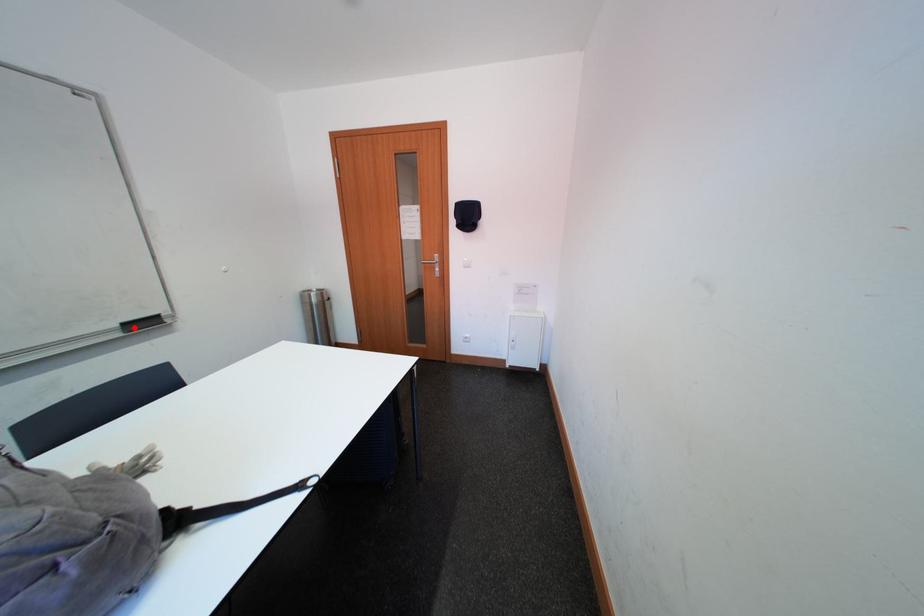
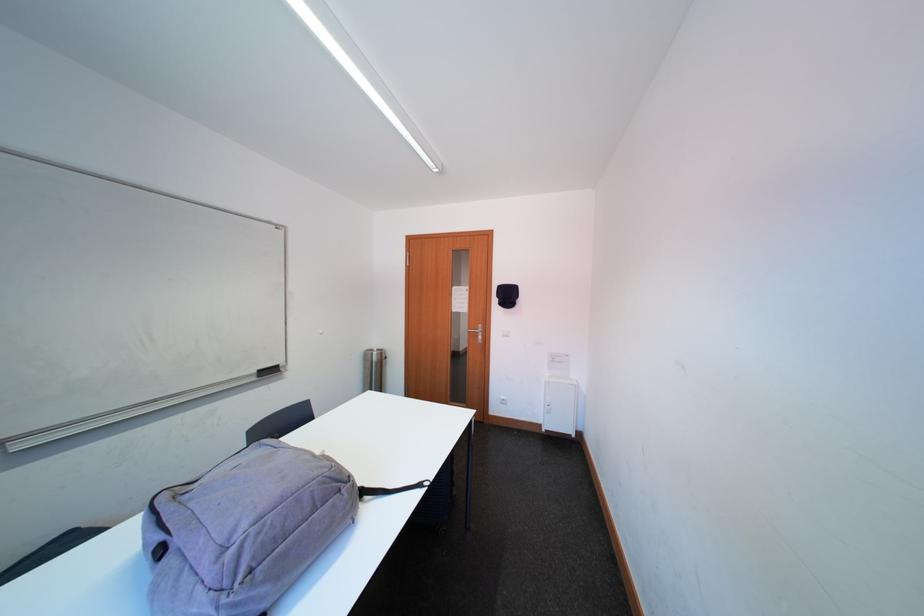
Question: I am providing you with two images of the same scene from different viewpoints. A red point is marked on the first image. Is the red point's position out of view in image 2?

Choices:
 (A) Yes
 (B) No

Answer: (B)